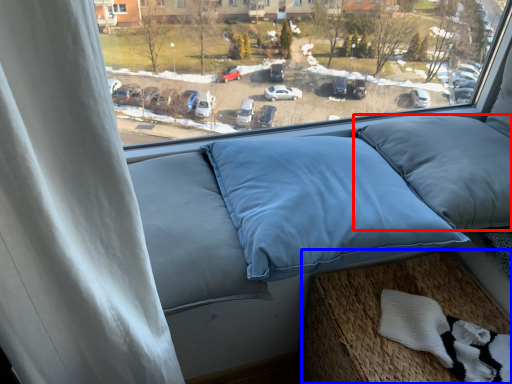
Question: Among these objects, which one is farthest to the camera, pillow (highlighted by a red box) or bed frame (highlighted by a blue box)?

Choices:
 (A) pillow
 (B) bed frame

Answer: (A)